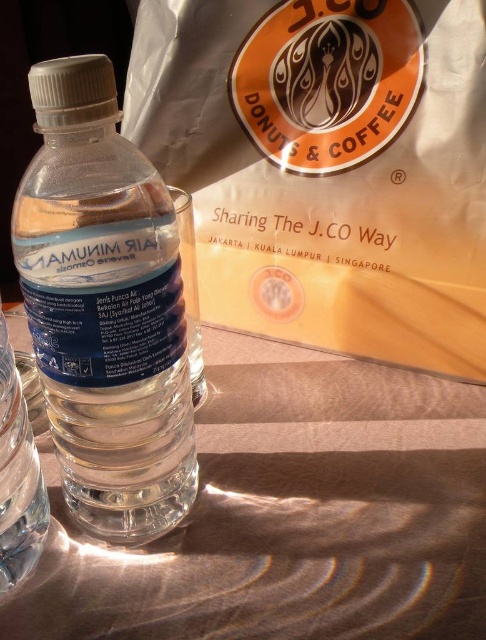
Between translucent plastic water at center and clear plastic bottle at center, which one appears on the left side from the viewer's perspective?

clear plastic bottle at center is more to the left.

Which is in front, point (108, 632) or point (56, 326)?

Point (56, 326) is in front.

Image resolution: width=486 pixels, height=640 pixels. What are the coordinates of `translucent plastic water at center` in the screenshot? It's located at (292, 515).